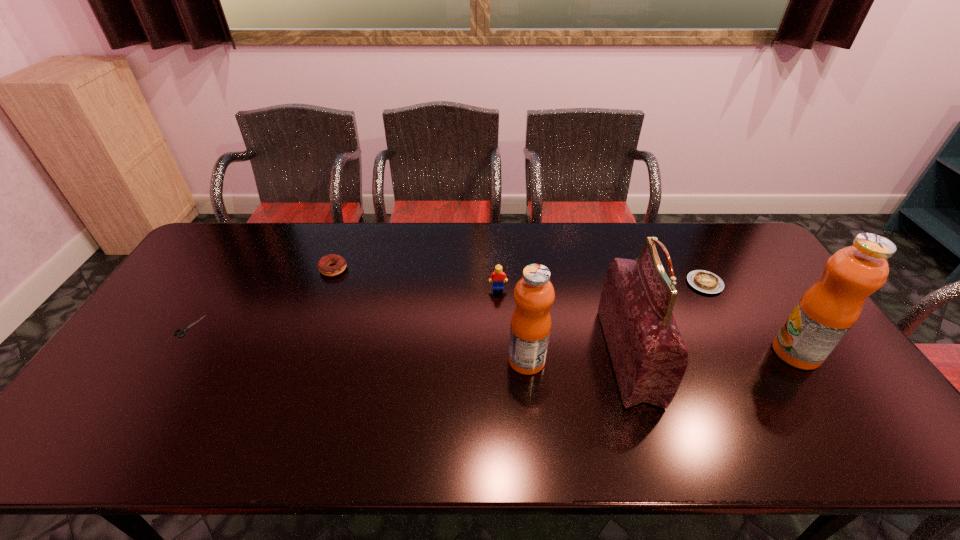
Please point out where to position a new fruit juice on the left to maintain spacing. Please provide its 2D coordinates. Your answer should be formatted as a tuple, i.e. [(x, y)], where the tuple contains the x and y coordinates of a point satisfying the conditions above.

[(249, 368)]